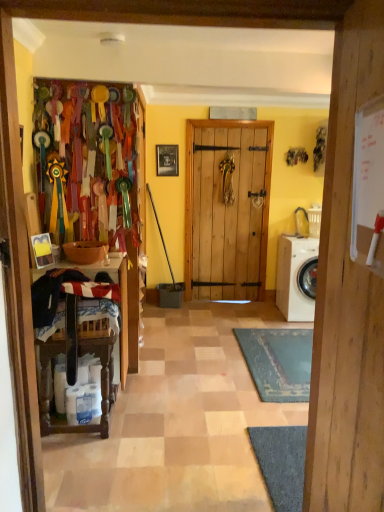
Question: Is wooden frame at center to the right of white matte washing machine at right from the viewer's perspective?

Choices:
 (A) no
 (B) yes

Answer: (A)

Question: Considering the relative sizes of wooden frame at center and white matte washing machine at right in the image provided, is wooden frame at center taller than white matte washing machine at right?

Choices:
 (A) yes
 (B) no

Answer: (B)

Question: Is white matte washing machine at right completely or partially inside wooden frame at center?

Choices:
 (A) yes
 (B) no

Answer: (B)

Question: Is wooden frame at center thinner than white matte washing machine at right?

Choices:
 (A) yes
 (B) no

Answer: (A)

Question: Is wooden frame at center facing away from white matte washing machine at right?

Choices:
 (A) yes
 (B) no

Answer: (B)

Question: Do you think wooden frame at center is within wooden door at center, or outside of it?

Choices:
 (A) outside
 (B) inside

Answer: (A)

Question: From the image's perspective, relative to wooden door at center, is wooden frame at center above or below?

Choices:
 (A) below
 (B) above

Answer: (B)

Question: From a real-world perspective, is wooden frame at center positioned above or below wooden door at center?

Choices:
 (A) above
 (B) below

Answer: (A)

Question: From their relative heights in the image, would you say wooden frame at center is taller or shorter than wooden door at center?

Choices:
 (A) short
 (B) tall

Answer: (A)

Question: Relative to white matte washing machine at right, is wooden frame at center in front or behind?

Choices:
 (A) front
 (B) behind

Answer: (B)

Question: From a real-world perspective, is wooden frame at center positioned above or below white matte washing machine at right?

Choices:
 (A) above
 (B) below

Answer: (A)

Question: Considering the positions of wooden frame at center and white matte washing machine at right in the image, is wooden frame at center wider or thinner than white matte washing machine at right?

Choices:
 (A) thin
 (B) wide

Answer: (A)

Question: From the image's perspective, is wooden frame at center located above or below white matte washing machine at right?

Choices:
 (A) below
 (B) above

Answer: (B)

Question: Relative to white matte washing machine at right, is wooden door at center in front or behind?

Choices:
 (A) behind
 (B) front

Answer: (B)

Question: Considering the positions of point (344, 355) and point (279, 308), is point (344, 355) closer or farther from the camera than point (279, 308)?

Choices:
 (A) farther
 (B) closer

Answer: (B)